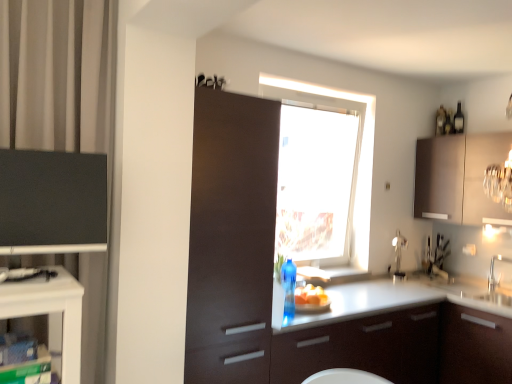
Question: Is transparent glass window at center wider than matte black cabinet at left, placed as the third cabinetry when sorted from right to left?

Choices:
 (A) no
 (B) yes

Answer: (B)

Question: Considering the relative positions of transparent glass window at center and matte black cabinet at left, acting as the 1th cabinetry starting from the left, in the image provided, is transparent glass window at center to the right of matte black cabinet at left, acting as the 1th cabinetry starting from the left, from the viewer's perspective?

Choices:
 (A) no
 (B) yes

Answer: (B)

Question: Is transparent glass window at center positioned beyond the bounds of matte black cabinet at left, placed as the 1th cabinetry when sorted from front to back?

Choices:
 (A) no
 (B) yes

Answer: (B)

Question: From a real-world perspective, is transparent glass window at center on top of matte black cabinet at left, placed as the third cabinetry when sorted from right to left?

Choices:
 (A) yes
 (B) no

Answer: (A)

Question: Could you tell me if transparent glass window at center is turned towards matte black cabinet at left, placed as the 1th cabinetry when sorted from front to back?

Choices:
 (A) no
 (B) yes

Answer: (A)

Question: From the image's perspective, is transparent glass window at center on top of matte black cabinet at left, placed as the third cabinetry when sorted from right to left?

Choices:
 (A) no
 (B) yes

Answer: (B)

Question: From the image's perspective, is matte black cabinet at left, acting as the 1th cabinetry starting from the left, located beneath matte brown cabinet at center, the second cabinetry in the left-to-right sequence?

Choices:
 (A) yes
 (B) no

Answer: (B)

Question: Is matte black cabinet at left, placed as the 1th cabinetry when sorted from front to back, at the left side of matte brown cabinet at center, which appears as the 2th cabinetry when viewed from the front?

Choices:
 (A) no
 (B) yes

Answer: (B)

Question: From the image's perspective, is matte black cabinet at left, acting as the 1th cabinetry starting from the left, on top of matte brown cabinet at center, the 2th cabinetry from the back?

Choices:
 (A) no
 (B) yes

Answer: (B)

Question: Are matte black cabinet at left, placed as the third cabinetry when sorted from right to left, and matte brown cabinet at center, positioned as the 2th cabinetry in right-to-left order, located far from each other?

Choices:
 (A) yes
 (B) no

Answer: (B)

Question: Does matte black cabinet at left, acting as the 3th cabinetry starting from the back, have a smaller size compared to matte brown cabinet at center, positioned as the 2th cabinetry in right-to-left order?

Choices:
 (A) no
 (B) yes

Answer: (B)

Question: Is matte black cabinet at left, acting as the 3th cabinetry starting from the back, closer to camera compared to matte brown cabinet at center, positioned as the 2th cabinetry in right-to-left order?

Choices:
 (A) no
 (B) yes

Answer: (B)

Question: Can you confirm if transparent glass window at center is bigger than satin brown cabinet at upper right, the first cabinetry in the right-to-left sequence?

Choices:
 (A) no
 (B) yes

Answer: (B)